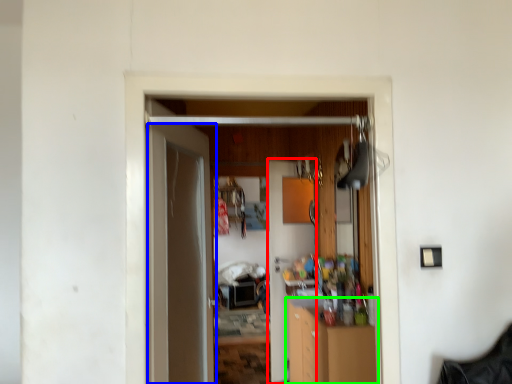
Question: Based on their relative distances, which object is nearer to door (highlighted by a red box)? Choose from door (highlighted by a blue box) and cabinetry (highlighted by a green box).

Choices:
 (A) door
 (B) cabinetry

Answer: (B)